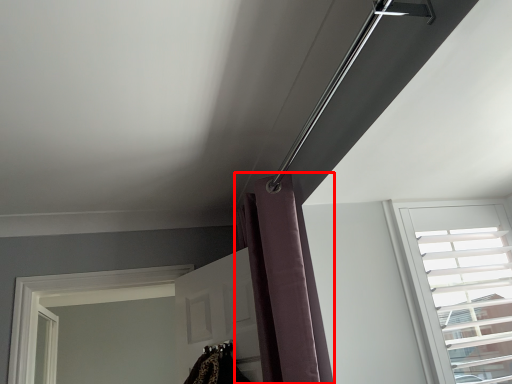
Question: From the image, what is the correct spatial relationship of shower curtain (annotated by the red box) in relation to window?

Choices:
 (A) right
 (B) left

Answer: (B)